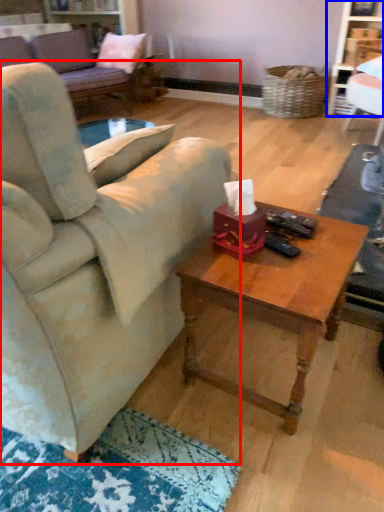
Question: Among these objects, which one is nearest to the camera, studio couch (highlighted by a red box) or bookshelf (highlighted by a blue box)?

Choices:
 (A) studio couch
 (B) bookshelf

Answer: (A)